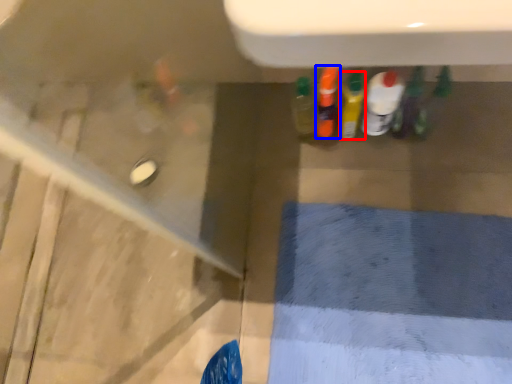
Question: Which object is further to the camera taking this photo, bottle (highlighted by a red box) or bottle (highlighted by a blue box)?

Choices:
 (A) bottle
 (B) bottle

Answer: (B)